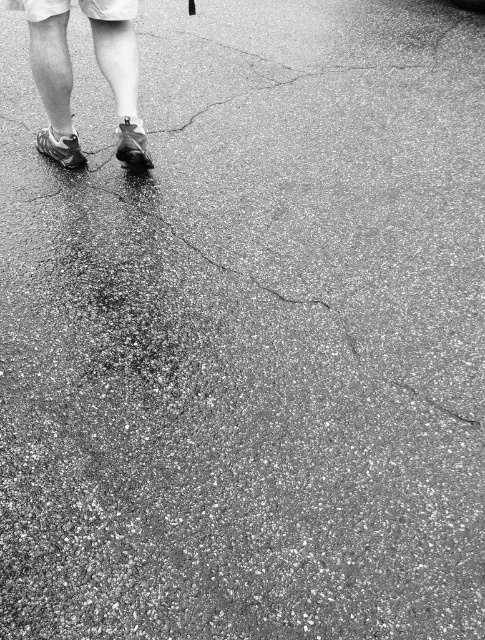
Is shiny black sandal at center smaller than shiny black shoe at lower left?

No, shiny black sandal at center is not smaller than shiny black shoe at lower left.

Can you confirm if shiny black sandal at center is shorter than shiny black shoe at lower left?

No, shiny black sandal at center is not shorter than shiny black shoe at lower left.

Between point (135, 131) and point (77, 145), which one is positioned behind?

Positioned behind is point (77, 145).

Identify the location of shiny black sandal at center. (131, 145).

Who is more forward, (119, 156) or (77, 166)?

Positioned in front is point (119, 156).

Does point (57, 141) come in front of point (80, 148)?

Yes, it is.

Where is `matte black sneakers at lower left`? Image resolution: width=485 pixels, height=640 pixels. matte black sneakers at lower left is located at coordinates (51, 76).

Is matte black sneakers at lower left smaller than shiny black sandal at center?

No.

Who is shorter, matte black sneakers at lower left or shiny black sandal at center?

shiny black sandal at center

Is point (65, 10) closer to viewer compared to point (119, 145)?

Yes, it is in front of point (119, 145).

At what (x,y) coordinates should I click in order to perform the action: click on matte black sneakers at lower left. Please return your answer as a coordinate pair (x, y). The height and width of the screenshot is (640, 485). Looking at the image, I should click on (x=51, y=76).